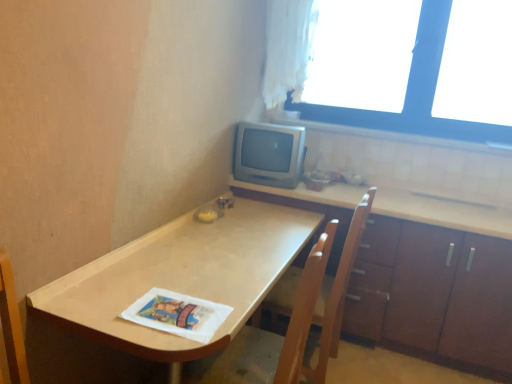
Question: Should I look upward or downward to see white paper magazine at lower center?

Choices:
 (A) down
 (B) up

Answer: (A)

Question: From a real-world perspective, is white sheer curtain at upper right positioned over wooden swivel chair at center based on gravity?

Choices:
 (A) no
 (B) yes

Answer: (B)

Question: Does white sheer curtain at upper right have a larger size compared to wooden swivel chair at center?

Choices:
 (A) no
 (B) yes

Answer: (A)

Question: Does white sheer curtain at upper right turn towards wooden swivel chair at center?

Choices:
 (A) yes
 (B) no

Answer: (B)

Question: Is the surface of white sheer curtain at upper right in direct contact with wooden swivel chair at center?

Choices:
 (A) no
 (B) yes

Answer: (A)

Question: Is white sheer curtain at upper right far from wooden swivel chair at center?

Choices:
 (A) no
 (B) yes

Answer: (B)

Question: Does white sheer curtain at upper right lie behind wooden swivel chair at center?

Choices:
 (A) yes
 (B) no

Answer: (A)

Question: From the image's perspective, would you say wooden chair at center is shown under white sheer curtain at upper right?

Choices:
 (A) yes
 (B) no

Answer: (A)

Question: Can you confirm if wooden chair at center is taller than white sheer curtain at upper right?

Choices:
 (A) yes
 (B) no

Answer: (A)

Question: Considering the relative sizes of wooden chair at center and white sheer curtain at upper right in the image provided, is wooden chair at center thinner than white sheer curtain at upper right?

Choices:
 (A) no
 (B) yes

Answer: (A)

Question: Is wooden chair at center positioned with its back to white sheer curtain at upper right?

Choices:
 (A) yes
 (B) no

Answer: (B)

Question: From a real-world perspective, does wooden chair at center sit lower than white sheer curtain at upper right?

Choices:
 (A) no
 (B) yes

Answer: (B)

Question: Would you say wooden chair at center is a long distance from white sheer curtain at upper right?

Choices:
 (A) no
 (B) yes

Answer: (B)

Question: Does white sheer curtain at upper right have a lesser width compared to brown wood cabinet at lower right?

Choices:
 (A) no
 (B) yes

Answer: (B)